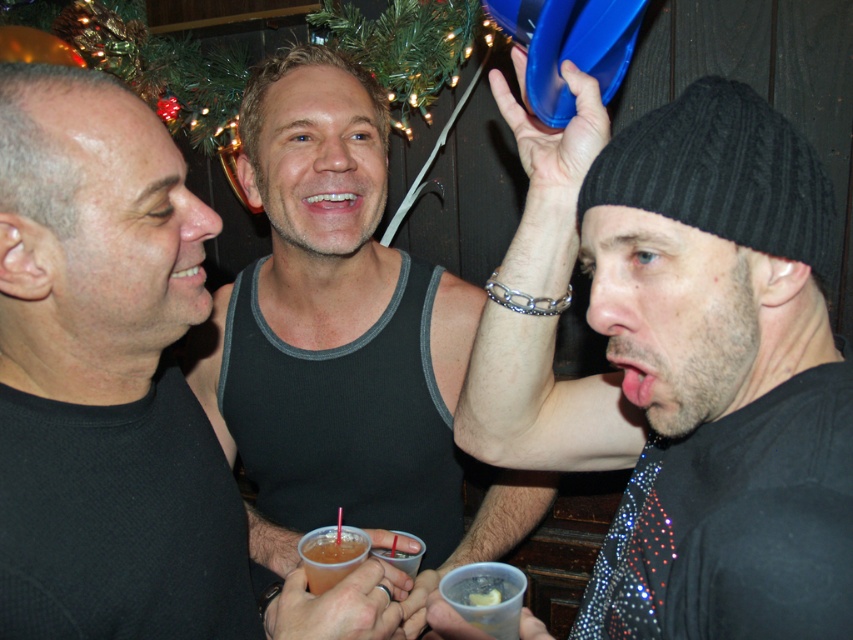
Can you confirm if black matte tank top at upper center is thinner than black knitted beanie at upper right?

Incorrect, black matte tank top at upper center's width is not less than black knitted beanie at upper right's.

Between point (172, 177) and point (737, 131), which one is positioned behind?

Point (172, 177)

Where is `black matte tank top at upper center`? The height and width of the screenshot is (640, 853). black matte tank top at upper center is located at coordinates (100, 252).

Between point (490, 621) and point (328, 579), which one is positioned in front?

Point (490, 621) is more forward.

Does point (514, 582) lie behind point (344, 529)?

No, (514, 582) is in front of (344, 529).

Locate an element on the screen. clear plastic cup at lower center is located at coordinates (485, 593).

Identify the location of black tank top at center. (343, 340).

Is black tank top at center above black knitted beanie at upper right?

No, black tank top at center is not above black knitted beanie at upper right.

The height and width of the screenshot is (640, 853). Find the location of `black tank top at center`. black tank top at center is located at coordinates click(x=343, y=340).